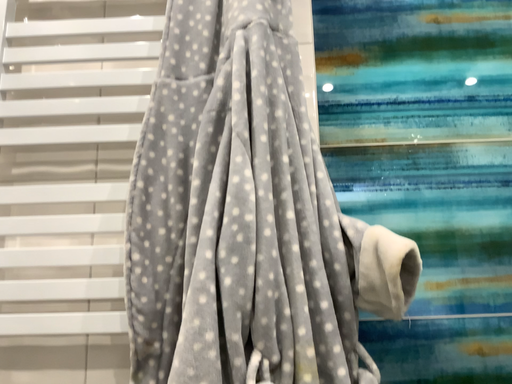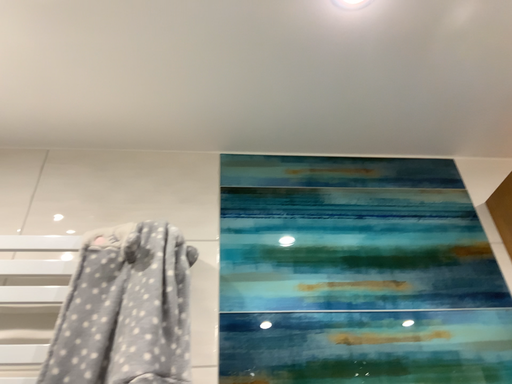
Question: How did the camera likely rotate when shooting the video?

Choices:
 (A) rotated upward
 (B) rotated downward

Answer: (A)